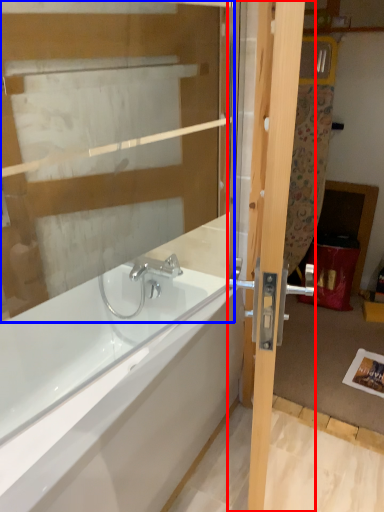
Question: Which object appears farthest to the camera in this image, door (highlighted by a red box) or glass door (highlighted by a blue box)?

Choices:
 (A) door
 (B) glass door

Answer: (B)